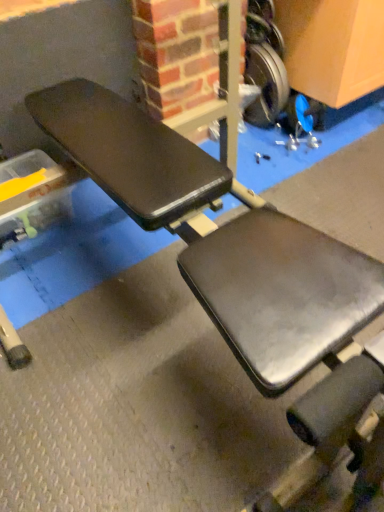
Question: Is point (266, 111) closer or farther from the camera than point (283, 40)?

Choices:
 (A) closer
 (B) farther

Answer: (B)

Question: Considering the positions of silver metallic weight at upper right, which is counted as the second wheel, starting from the top, and metallic silver wheel at upper right, the first wheel from the top, in the image, is silver metallic weight at upper right, which is counted as the second wheel, starting from the top, wider or thinner than metallic silver wheel at upper right, the first wheel from the top,?

Choices:
 (A) wide
 (B) thin

Answer: (B)

Question: Is silver metallic weight at upper right, which is counted as the second wheel, starting from the top, inside the boundaries of metallic silver wheel at upper right, the 2th wheel ordered from the bottom, or outside?

Choices:
 (A) inside
 (B) outside

Answer: (B)

Question: Looking at their shapes, would you say metallic silver wheel at upper right, the 2th wheel ordered from the bottom, is wider or thinner than silver metallic weight at upper right, the 1th wheel from the bottom?

Choices:
 (A) wide
 (B) thin

Answer: (A)

Question: Based on their positions, is metallic silver wheel at upper right, the first wheel from the top, located to the left or right of silver metallic weight at upper right, the 1th wheel from the bottom?

Choices:
 (A) right
 (B) left

Answer: (B)

Question: Is metallic silver wheel at upper right, the 2th wheel ordered from the bottom, inside the boundaries of silver metallic weight at upper right, the 1th wheel from the bottom, or outside?

Choices:
 (A) outside
 (B) inside

Answer: (A)

Question: From the image's perspective, is metallic silver wheel at upper right, the 2th wheel ordered from the bottom, positioned above or below silver metallic weight at upper right, the 1th wheel from the bottom?

Choices:
 (A) above
 (B) below

Answer: (A)